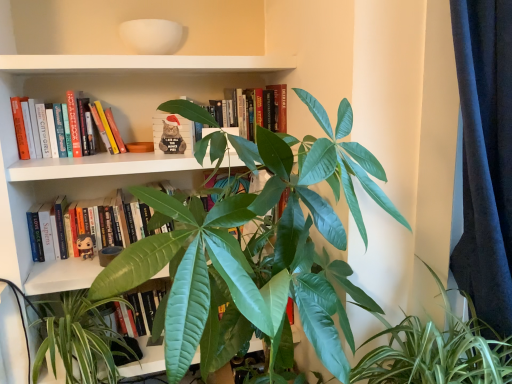
Question: Is hardcover book at center, the 1th book in the bottom-to-top sequence, far away from green glossy leaf at lower center?

Choices:
 (A) yes
 (B) no

Answer: (B)

Question: Is hardcover book at center, the 1th book in the bottom-to-top sequence, looking in the opposite direction of green glossy leaf at lower center?

Choices:
 (A) no
 (B) yes

Answer: (A)

Question: Is hardcover book at center, which is the fourth book from top to bottom, not within green glossy leaf at lower center?

Choices:
 (A) no
 (B) yes

Answer: (B)

Question: From the image's perspective, does hardcover book at center, which is the fourth book from top to bottom, appear higher than green glossy leaf at lower center?

Choices:
 (A) yes
 (B) no

Answer: (A)

Question: Can you confirm if hardcover book at center, which is the fourth book from top to bottom, is smaller than green glossy leaf at lower center?

Choices:
 (A) no
 (B) yes

Answer: (B)

Question: In terms of width, does santa hat plush cat at center, the second book from the bottom, look wider or thinner when compared to hardcover book at upper left, acting as the 3th book starting from the bottom?

Choices:
 (A) thin
 (B) wide

Answer: (A)

Question: Considering the positions of santa hat plush cat at center, the 3th book when ordered from top to bottom, and hardcover book at upper left, acting as the 3th book starting from the bottom, in the image, is santa hat plush cat at center, the 3th book when ordered from top to bottom, taller or shorter than hardcover book at upper left, acting as the 3th book starting from the bottom,?

Choices:
 (A) tall
 (B) short

Answer: (B)

Question: Considering their positions, is santa hat plush cat at center, the 3th book when ordered from top to bottom, located in front of or behind hardcover book at upper left, acting as the 3th book starting from the bottom?

Choices:
 (A) front
 (B) behind

Answer: (B)

Question: From the image's perspective, is santa hat plush cat at center, the second book from the bottom, positioned above or below hardcover book at upper left, acting as the 3th book starting from the bottom?

Choices:
 (A) above
 (B) below

Answer: (B)

Question: Would you say hardcover book at upper left, acting as the 3th book starting from the bottom, is to the left or to the right of hardcover book at center, positioned as the 4th book in bottom-to-top order, in the picture?

Choices:
 (A) right
 (B) left

Answer: (B)

Question: Do you think hardcover book at upper left, acting as the second book starting from the top, is within hardcover book at center, positioned as the 4th book in bottom-to-top order, or outside of it?

Choices:
 (A) outside
 (B) inside

Answer: (A)

Question: Is hardcover book at upper left, acting as the 3th book starting from the bottom, bigger or smaller than hardcover book at center, the first book from the top?

Choices:
 (A) big
 (B) small

Answer: (B)

Question: Considering the positions of hardcover book at upper left, acting as the second book starting from the top, and hardcover book at center, the first book from the top, in the image, is hardcover book at upper left, acting as the second book starting from the top, taller or shorter than hardcover book at center, the first book from the top,?

Choices:
 (A) tall
 (B) short

Answer: (B)

Question: From their relative heights in the image, would you say green glossy leafy plant at center, arranged as the 2th houseplant when viewed from the right, is taller or shorter than green glossy leafy plant at center, positioned as the 2th houseplant in left-to-right order?

Choices:
 (A) short
 (B) tall

Answer: (B)

Question: In the image, is green glossy leafy plant at center, arranged as the 2th houseplant when viewed from the right, positioned in front of or behind green glossy leafy plant at center, the 1th houseplant in the right-to-left sequence?

Choices:
 (A) front
 (B) behind

Answer: (A)